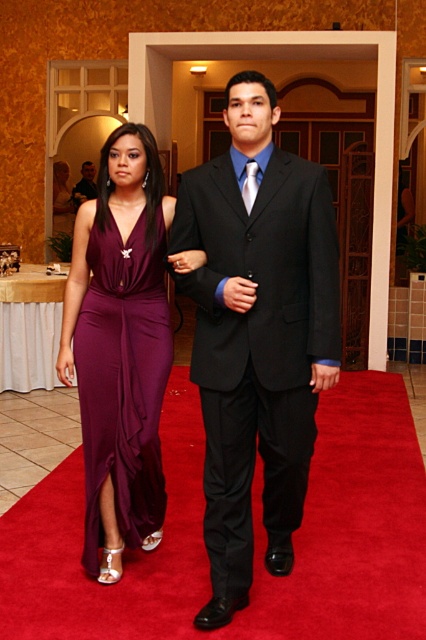
Which is behind, point (134, 424) or point (81, 170)?

The point (81, 170) is more distant.

Who is taller, matte purple satin dress at center or matte black suit at center?

matte purple satin dress at center is taller.

Is point (92, 426) less distant than point (89, 173)?

That is True.

Identify the location of matte purple satin dress at center. Image resolution: width=426 pixels, height=640 pixels. (123, 380).

In the scene shown: Does black satin suit at center have a greater width compared to matte purple satin dress at center?

Indeed, black satin suit at center has a greater width compared to matte purple satin dress at center.

Does point (299, 262) lie in front of point (158, 408)?

Yes, point (299, 262) is in front of point (158, 408).

Is point (198, 289) more distant than point (158, 365)?

That is False.

This screenshot has height=640, width=426. I want to click on black satin suit at center, so click(256, 332).

Is point (216, 618) behind point (95, 193)?

That is False.

Does black satin suit at center appear over matte black suit at center?

No.

What do you see at coordinates (256, 332) in the screenshot?
I see `black satin suit at center` at bounding box center [256, 332].

Where is `black satin suit at center`? The width and height of the screenshot is (426, 640). black satin suit at center is located at coordinates (256, 332).